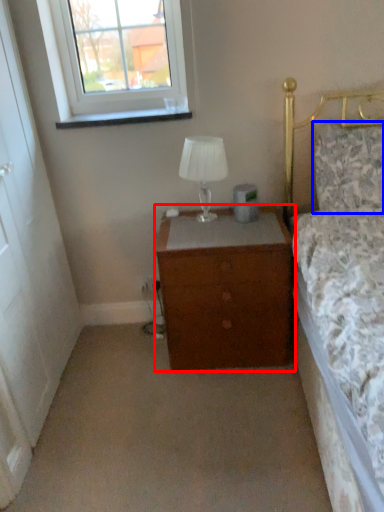
Question: Which object appears farthest to the camera in this image, chest of drawers (highlighted by a red box) or pillow (highlighted by a blue box)?

Choices:
 (A) chest of drawers
 (B) pillow

Answer: (A)